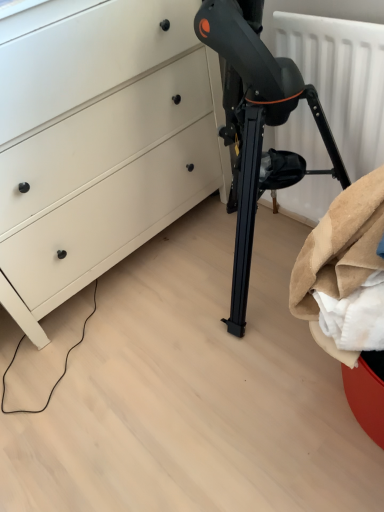
Question: Is point (296, 206) closer or farther from the camera than point (29, 88)?

Choices:
 (A) closer
 (B) farther

Answer: (B)

Question: Considering the positions of white matte radiator at upper right and white matte chest of drawers at lower left in the image, is white matte radiator at upper right bigger or smaller than white matte chest of drawers at lower left?

Choices:
 (A) small
 (B) big

Answer: (A)

Question: From the image's perspective, is white matte radiator at upper right above or below white matte chest of drawers at lower left?

Choices:
 (A) below
 (B) above

Answer: (A)

Question: Does point (96, 222) appear closer or farther from the camera than point (332, 180)?

Choices:
 (A) farther
 (B) closer

Answer: (B)

Question: Looking at their shapes, would you say white matte chest of drawers at lower left is wider or thinner than white matte radiator at upper right?

Choices:
 (A) thin
 (B) wide

Answer: (B)

Question: In terms of size, does white matte chest of drawers at lower left appear bigger or smaller than white matte radiator at upper right?

Choices:
 (A) big
 (B) small

Answer: (A)

Question: In the image, is white matte chest of drawers at lower left positioned in front of or behind white matte radiator at upper right?

Choices:
 (A) front
 (B) behind

Answer: (A)